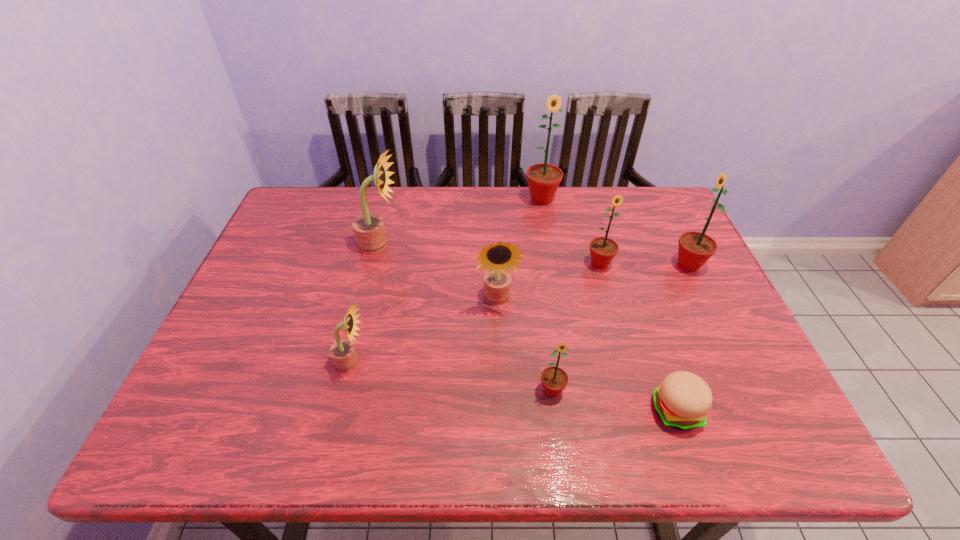
Locate an element on the screen. blank space at the near left corner of the desktop is located at coordinates (210, 425).

Image resolution: width=960 pixels, height=540 pixels. Find the location of `vacant area at the far right corner`. vacant area at the far right corner is located at coordinates (670, 212).

Where is `vacant area between the rightmost object and the tallest object`? This screenshot has width=960, height=540. vacant area between the rightmost object and the tallest object is located at coordinates (615, 232).

The image size is (960, 540). What are the coordinates of `free space that is in between the nearest sunflower and the tallest sunflower` in the screenshot? It's located at (547, 295).

The height and width of the screenshot is (540, 960). What are the coordinates of `free area in between the tallest sunflower and the biggest yellow sunflower` in the screenshot? It's located at tap(461, 221).

In order to click on free space between the fifth farthest object and the shortest object in this screenshot , I will do `click(587, 355)`.

The width and height of the screenshot is (960, 540). Identify the location of empty space that is in between the shortest object and the second smallest green sunflower. (637, 337).

Identify the location of empty space between the tallest object and the biggest yellow sunflower. (461, 221).

Identify the location of blank region between the shortest object and the sixth sunflower from left to right. (637, 337).

Image resolution: width=960 pixels, height=540 pixels. Find the location of `free space between the third biggest green sunflower and the smallest green sunflower`. free space between the third biggest green sunflower and the smallest green sunflower is located at coordinates (576, 327).